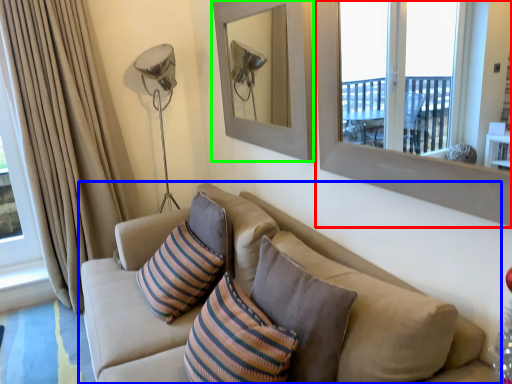
Question: Based on their relative distances, which object is farther from window frame (highlighted by a red box)? Choose from studio couch (highlighted by a blue box) and picture frame (highlighted by a green box).

Choices:
 (A) studio couch
 (B) picture frame

Answer: (B)